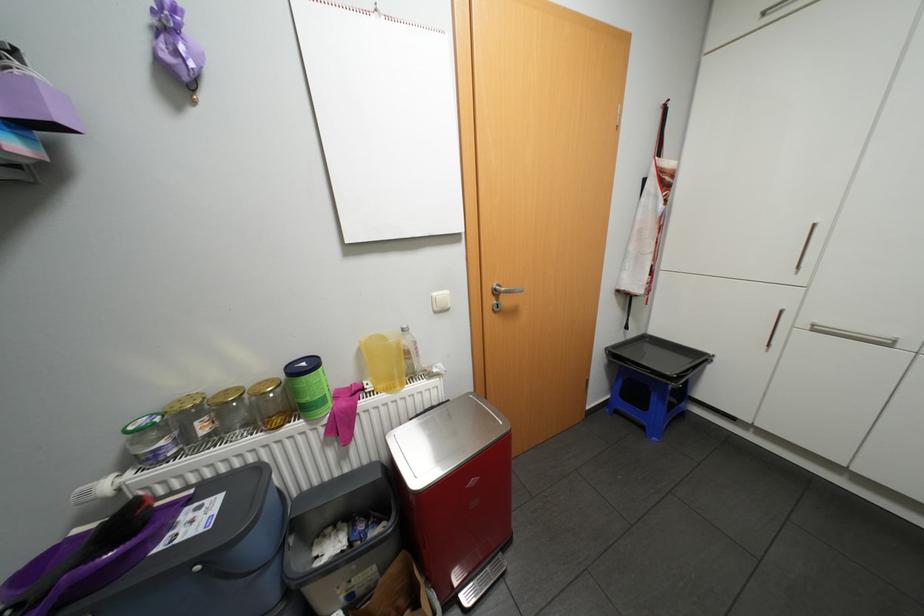
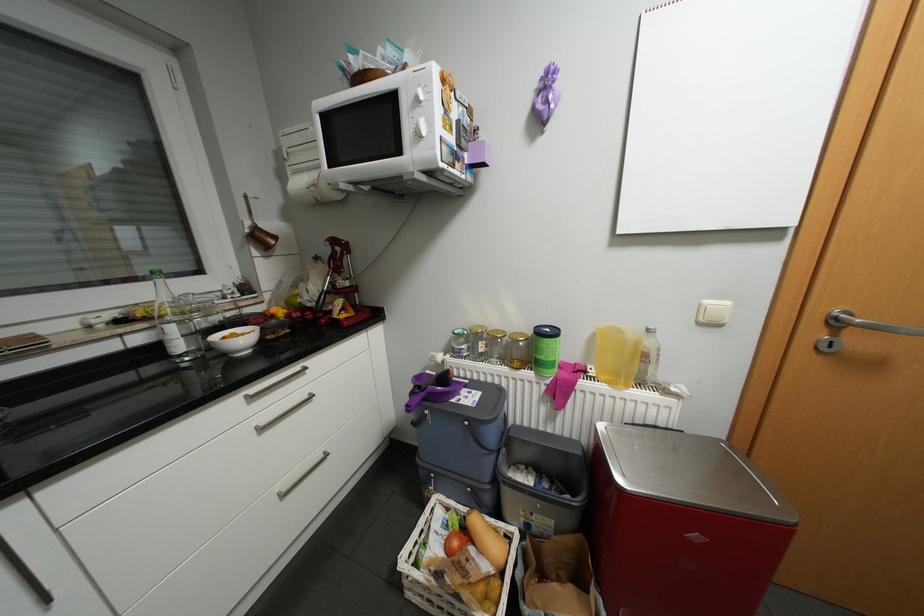
Where in the second image is the point corresponding to the point at 350,455 from the first image?

(558, 416)